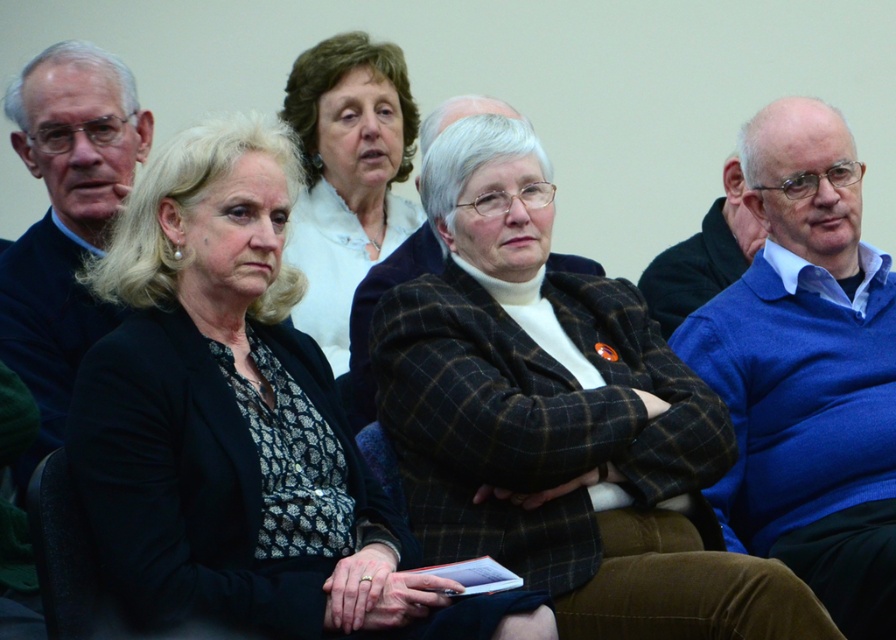
Question: Which point is farther from the camera taking this photo?

Choices:
 (A) (299, 76)
 (B) (229, 312)

Answer: (A)

Question: Does black textured blazer at center appear over white woolen sweater at upper center?

Choices:
 (A) yes
 (B) no

Answer: (B)

Question: Which of the following is the farthest from the observer?

Choices:
 (A) (382, 232)
 (B) (119, 522)

Answer: (A)

Question: Is the position of black textured blazer at center more distant than that of white woolen sweater at upper center?

Choices:
 (A) yes
 (B) no

Answer: (B)

Question: Does black textured blazer at center lie in front of white woolen sweater at upper center?

Choices:
 (A) yes
 (B) no

Answer: (A)